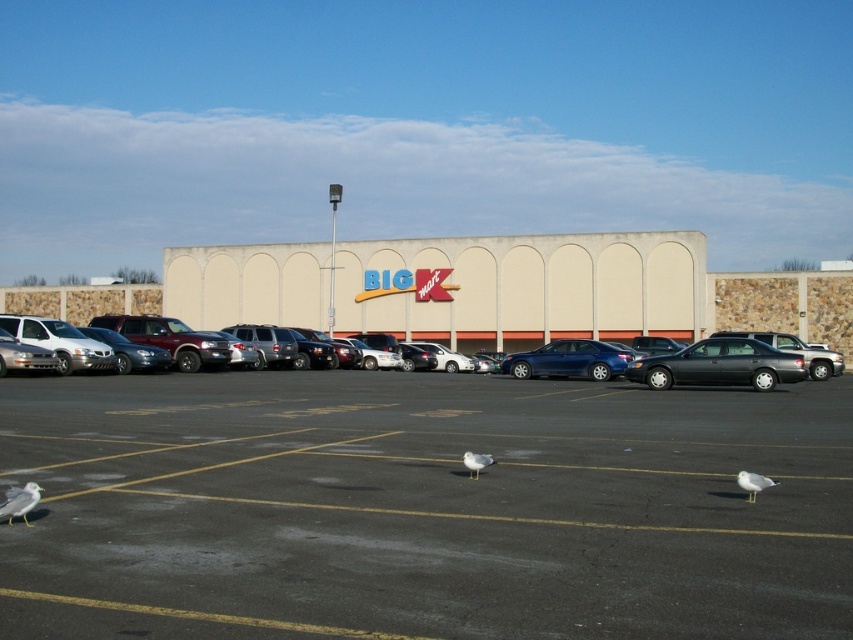
Can you confirm if black asphalt parking lot at center is taller than matte blue sedan at center?

In fact, black asphalt parking lot at center may be shorter than matte blue sedan at center.

Who is more distant from viewer, (26, 627) or (596, 344)?

Point (596, 344)

Is point (602, 451) behind point (587, 342)?

No, (602, 451) is in front of (587, 342).

Where is `black asphalt parking lot at center`? The width and height of the screenshot is (853, 640). black asphalt parking lot at center is located at coordinates (424, 508).

Who is positioned more to the left, metallic silver sedan at center or white feathered bird at lower right?

From the viewer's perspective, metallic silver sedan at center appears more on the left side.

Consider the image. Between metallic silver sedan at center and white feathered bird at lower right, which one is positioned higher?

metallic silver sedan at center

Locate an element on the screen. This screenshot has height=640, width=853. metallic silver sedan at center is located at coordinates (780, 353).

In the scene shown: Can you confirm if shiny black sedan at center is smaller than white matte bird at lower left?

Actually, shiny black sedan at center might be larger than white matte bird at lower left.

Consider the image. Does shiny black sedan at center appear on the right side of white matte bird at lower left?

Correct, you'll find shiny black sedan at center to the right of white matte bird at lower left.

Locate an element on the screen. The image size is (853, 640). shiny black sedan at center is located at coordinates (718, 365).

This screenshot has height=640, width=853. Identify the location of shiny black sedan at center. (718, 365).